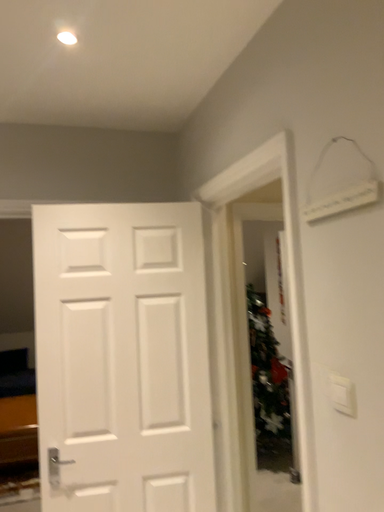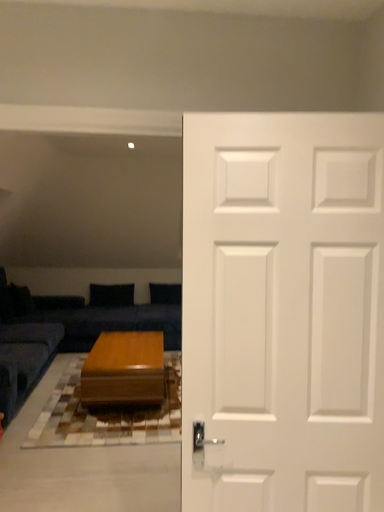
Question: Which way did the camera rotate in the video?

Choices:
 (A) rotated upward
 (B) rotated downward

Answer: (B)